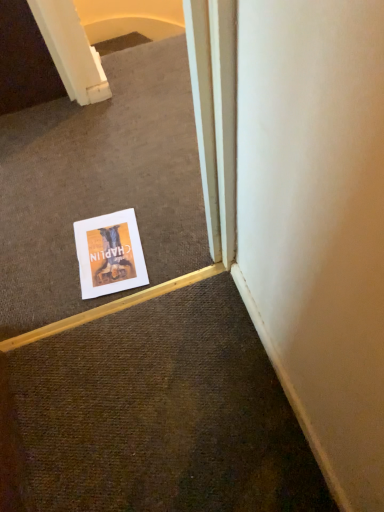
Locate an element on the screen. vacant space situated above white paper poster at center (from a real-world perspective) is located at coordinates (107, 250).